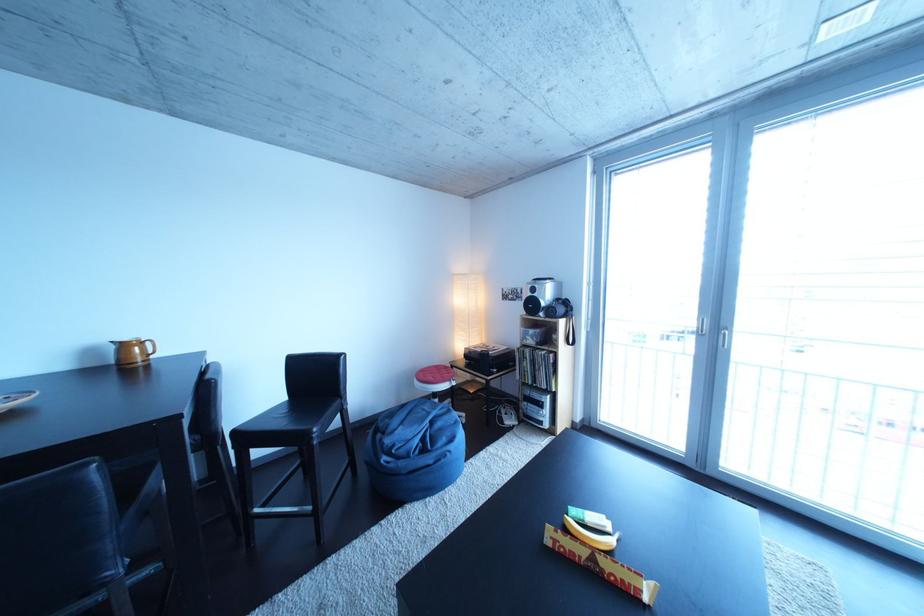
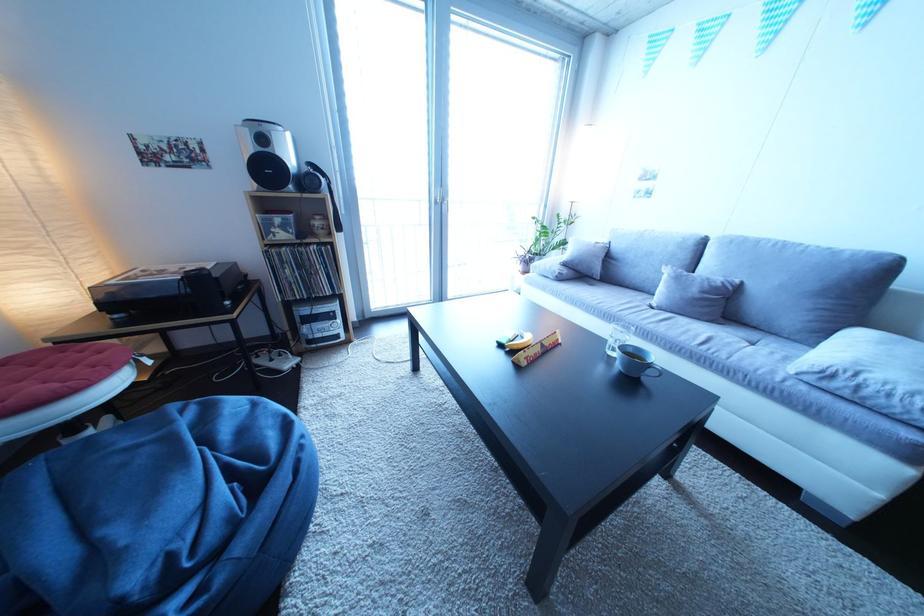
Find the pixel in the second image that matches (x=519, y=419) in the first image.

(285, 366)